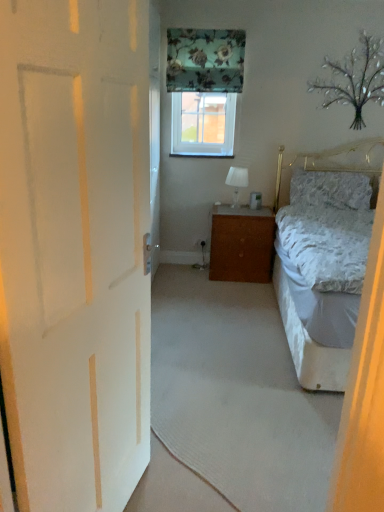
Question: From a real-world perspective, relative to white fabric lampshade at center, is white carpet at center vertically above or below?

Choices:
 (A) below
 (B) above

Answer: (A)

Question: In terms of height, does white carpet at center look taller or shorter compared to white fabric lampshade at center?

Choices:
 (A) short
 (B) tall

Answer: (A)

Question: Which object is positioned closest to the brown wood cabinet at center?

Choices:
 (A) white carpet at center
 (B) fluffy white pillow at right
 (C) white fabric lampshade at center
 (D) clear glass window at center
 (E) white matte door at left

Answer: (C)

Question: Which of these objects is positioned farthest from the clear glass window at center?

Choices:
 (A) brown wood cabinet at center
 (B) fluffy white pillow at right
 (C) white carpet at center
 (D) white matte door at left
 (E) white fabric lampshade at center

Answer: (D)